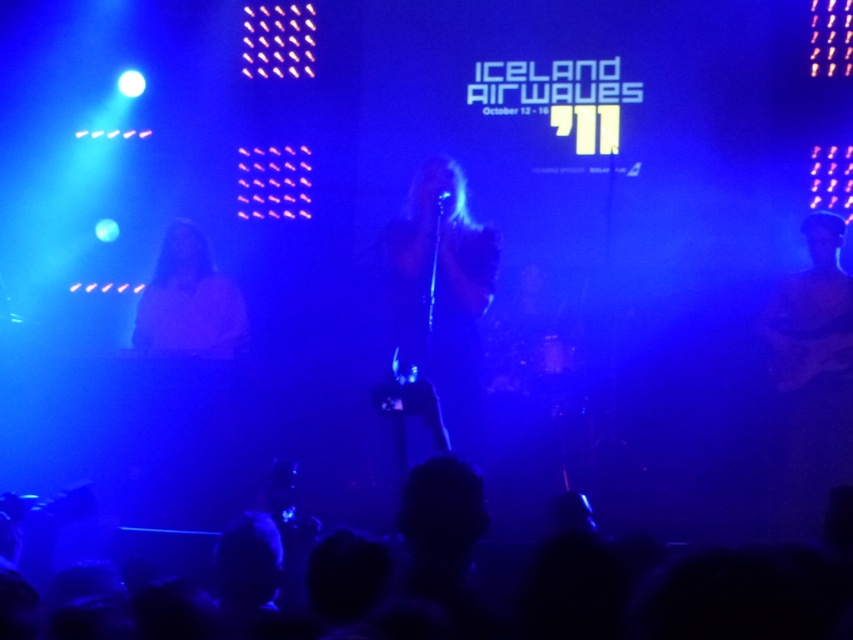
Question: Is the position of black matte shirt at center more distant than that of matte white shirt at center?

Choices:
 (A) no
 (B) yes

Answer: (A)

Question: Which point appears farthest from the camera in this image?

Choices:
 (A) (428, 161)
 (B) (169, 230)

Answer: (B)

Question: Which of the following is the farthest from the observer?

Choices:
 (A) (173, 260)
 (B) (462, 412)

Answer: (A)

Question: Which point is farther to the camera?

Choices:
 (A) (473, 449)
 (B) (206, 260)

Answer: (B)

Question: Where is black matte shirt at center located in relation to matte white shirt at center in the image?

Choices:
 (A) left
 (B) right

Answer: (B)

Question: Is black matte shirt at center to the right of matte white shirt at center from the viewer's perspective?

Choices:
 (A) no
 (B) yes

Answer: (B)